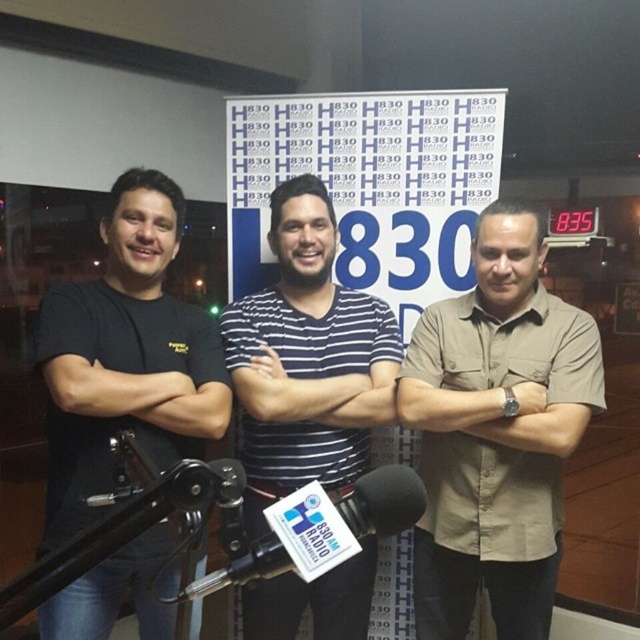
Does beige button-down shirt at center appear on the right side of beige fabric shirt at center?

Indeed, beige button-down shirt at center is positioned on the right side of beige fabric shirt at center.

This screenshot has height=640, width=640. Describe the element at coordinates (497, 433) in the screenshot. I see `beige button-down shirt at center` at that location.

What are the coordinates of `beige button-down shirt at center` in the screenshot? It's located at (497, 433).

Does beige fabric shirt at center appear over striped fabric at center?

Incorrect, beige fabric shirt at center is not positioned above striped fabric at center.

Which is above, beige fabric shirt at center or striped fabric at center?

Positioned higher is striped fabric at center.

Is point (419, 380) behind point (244, 371)?

Yes, it is behind point (244, 371).

Find the location of a particular element. beige fabric shirt at center is located at coordinates point(452,378).

Does black matte t-shirt at left lie in front of white striped shirt at center?

Yes, it is in front of white striped shirt at center.

Which of these two, black matte t-shirt at left or white striped shirt at center, stands shorter?

black matte t-shirt at left is shorter.

Is point (49, 465) positioned before point (337, 428)?

No.

What are the coordinates of `black matte t-shirt at left` in the screenshot? It's located at (125, 355).